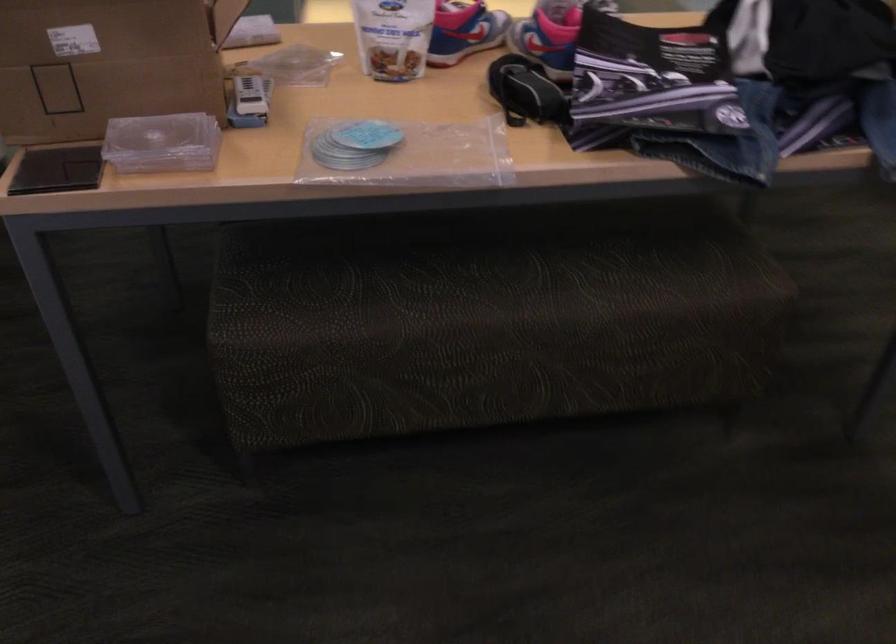
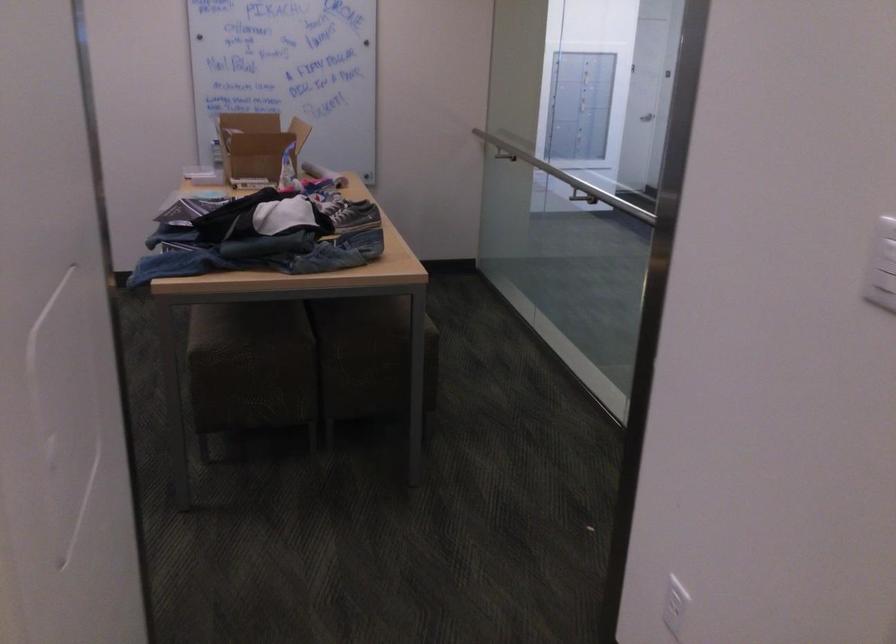
Question: I am providing you with two images of the same scene from different viewpoints. Which of the following objects are not visible in image2?

Choices:
 (A) white food bag
 (B) shower control lever
 (C) gray sneaker
 (D) white electrical outlet

Answer: (A)